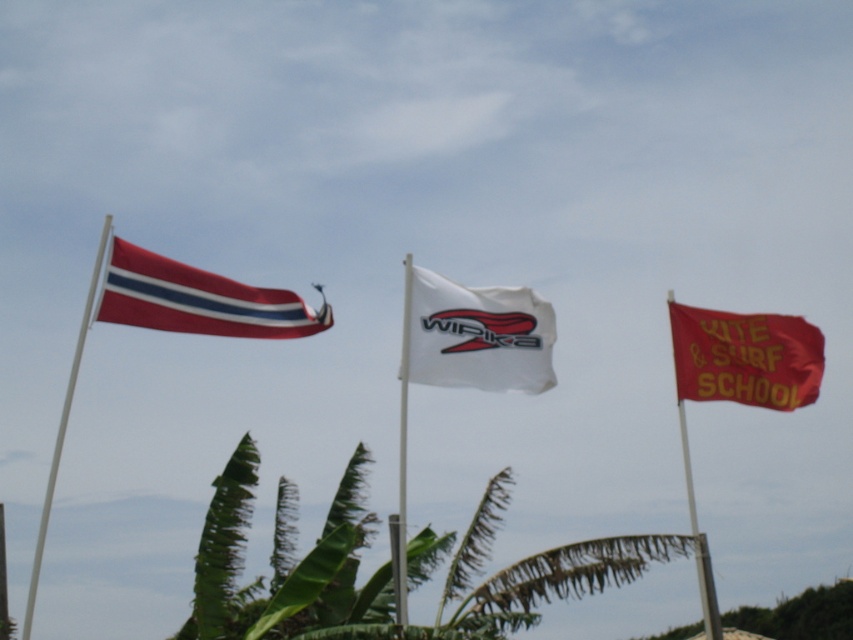
You are planning to place a new bench in the park scene shown. The bench requires at least 2 meters of space to the left and right. Given the green leafy palm tree at lower center and the red fabric kite surf school flag at right, can you determine if the available space between them is sufficient for the bench?

The green leafy palm tree at lower center is wider than the red fabric kite surf school flag at right, but without specific measurements of the distance between them, it is impossible to confirm if the space is sufficient for the bench requiring 2 meters on each side.

You are a photographer trying to capture the white fabric flag at center and the white plastic flag pole at center in a single shot. Based on their sizes, which one will appear larger in the photo?

The white plastic flag pole at center will appear larger in the photo because it is bigger than the white fabric flag at center.

You are planning to set up a picnic blanket under the green leafy palm tree at lower center. However, you also want to ensure that the red fabric kite surf school flag at right remains visible from your picnic spot. Based on their heights, will the palm tree block the view of the flag?

The green leafy palm tree at lower center is much taller than the red fabric kite surf school flag at right, so the palm tree may block the view of the flag from the picnic spot.